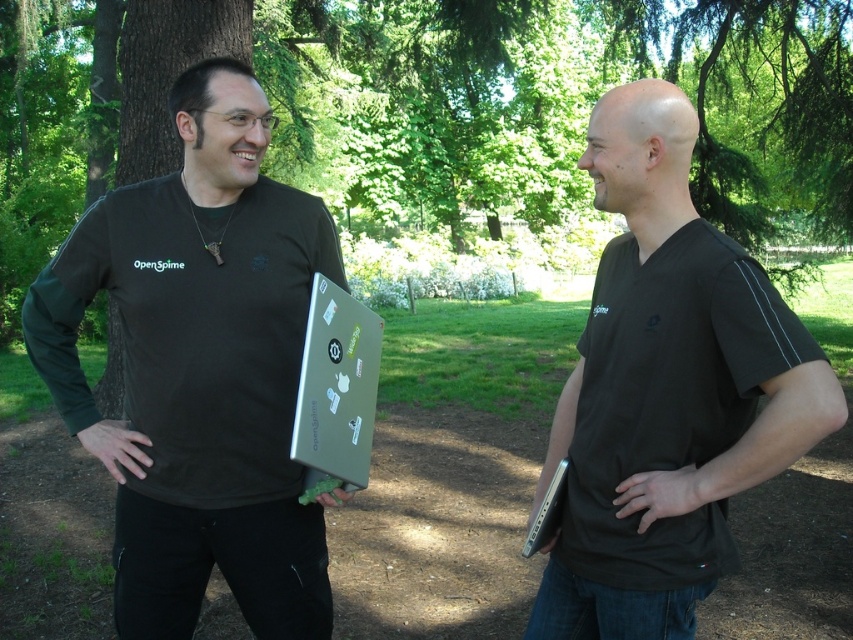
Question: Which of these objects is positioned closest to the green leafy tree at center?

Choices:
 (A) matte black laptop at center
 (B) black matte shirt at center
 (C) silver metallic laptop at center

Answer: (A)

Question: Which point is closer to the camera?

Choices:
 (A) (358, 410)
 (B) (38, 285)
 (C) (601, 387)
 (D) (264, 40)

Answer: (C)

Question: Does green leafy tree at center have a larger size compared to black matte shirt at center?

Choices:
 (A) no
 (B) yes

Answer: (B)

Question: Is green leafy tree at center bigger than matte black laptop at center?

Choices:
 (A) no
 (B) yes

Answer: (B)

Question: Which point is closer to the camera?

Choices:
 (A) green leafy tree at center
 (B) silver metallic laptop at center
 (C) black matte shirt at center
 (D) matte black laptop at center

Answer: (C)

Question: Can you confirm if black matte shirt at center is positioned to the right of silver metallic laptop at center?

Choices:
 (A) no
 (B) yes

Answer: (B)